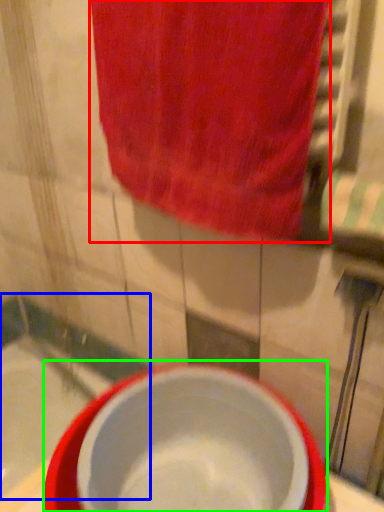
Question: Which object is positioned closest to towel (highlighted by a red box)? Select from bath (highlighted by a blue box) and basin (highlighted by a green box).

Choices:
 (A) bath
 (B) basin

Answer: (B)